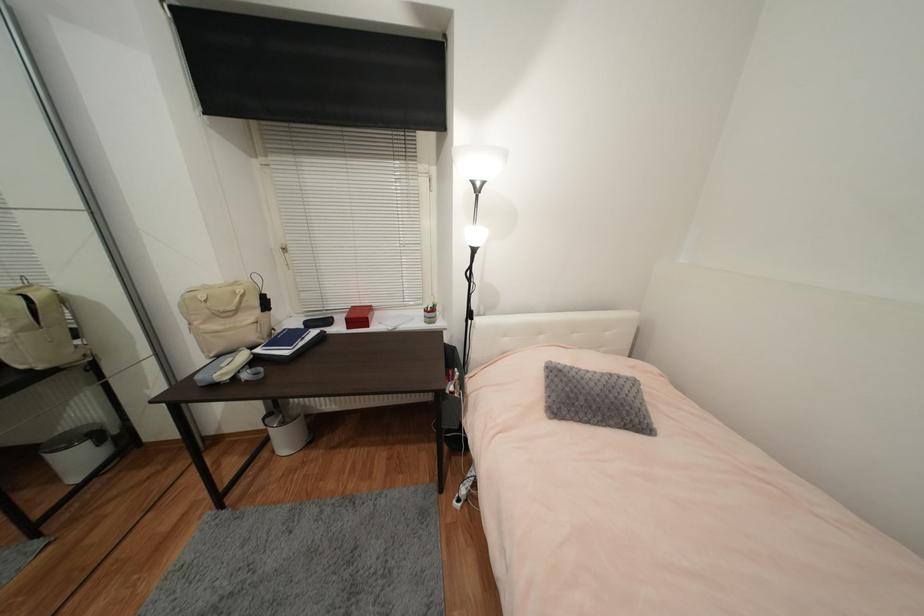
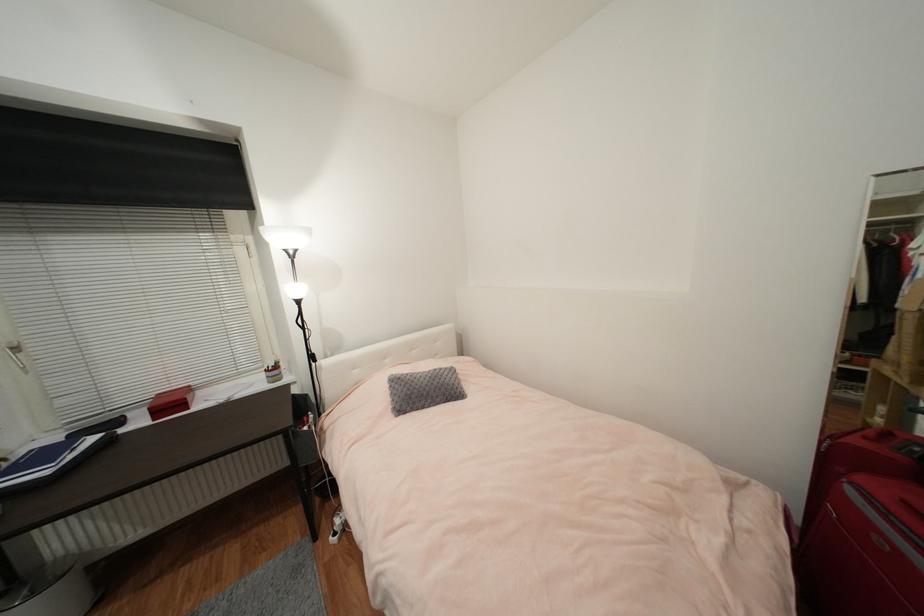
Question: The camera is either moving clockwise (left) or counter-clockwise (right) around the object. The first image is from the beginning of the video and the second image is from the end. Is the camera moving left or right when shooting the video?

Choices:
 (A) Left
 (B) Right

Answer: (A)